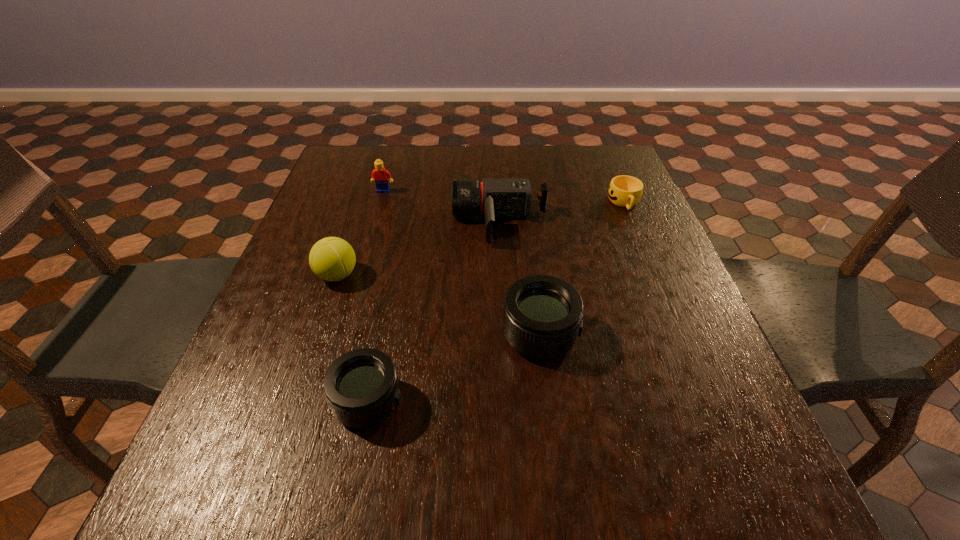
You are a GUI agent. You are given a task and a screenshot of the screen. Output one action in this format:
    pyautogui.click(x=<x>, y=<y>)
    Task: Click on the free region located on the side of the taller telephoto lens with brand markings and control switches
    
    Given the screenshot: What is the action you would take?
    pyautogui.click(x=655, y=334)

This screenshot has width=960, height=540. I want to click on vacant space located 0.290m on the lens of the camcorder, so click(340, 222).

The image size is (960, 540). What are the coordinates of `free region located on the lens of the camcorder` in the screenshot? It's located at (387, 222).

At what (x,y) coordinates should I click in order to perform the action: click on vacant space located 0.280m on the lens of the camcorder. Please return your answer as a coordinate pair (x, y). Looking at the image, I should click on (344, 222).

You are a GUI agent. You are given a task and a screenshot of the screen. Output one action in this format:
    pyautogui.click(x=<x>, y=<y>)
    Task: Click on the vacant space located 0.170m on the face of the Lego
    
    Given the screenshot: What is the action you would take?
    pyautogui.click(x=372, y=231)

The image size is (960, 540). I want to click on free location located on the front of the rightmost object, so click(x=639, y=240).

I want to click on blank space located on the right of the tennis ball, so click(538, 275).

Image resolution: width=960 pixels, height=540 pixels. In order to click on object present at the near edge in this screenshot , I will do `click(361, 386)`.

Identify the location of Lego positioned at the left edge. This screenshot has width=960, height=540. (380, 175).

The width and height of the screenshot is (960, 540). I want to click on tennis ball present at the left edge, so click(332, 259).